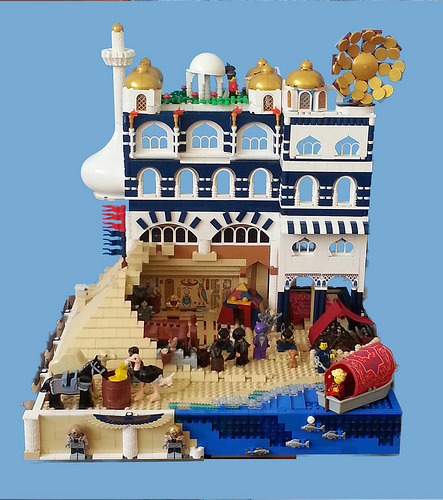
Where is `toy dog`? This screenshot has height=500, width=443. toy dog is located at coordinates (293, 355).